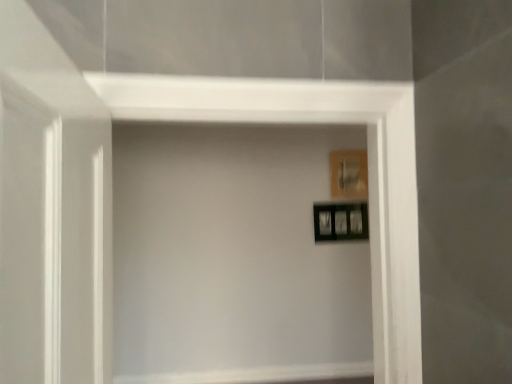
Question: Is transparent glass door at left to the left or to the right of black glossy picture frame at upper right, which appears as the 1th picture frame when ordered from the bottom, in the image?

Choices:
 (A) left
 (B) right

Answer: (A)

Question: Is point (51, 160) closer or farther from the camera than point (347, 218)?

Choices:
 (A) farther
 (B) closer

Answer: (B)

Question: Estimate the real-world distances between objects in this image. Which object is farther from the wooden picture frame at upper right, which is the 1th picture frame in top-to-bottom order?

Choices:
 (A) transparent glass door at left
 (B) black glossy picture frame at upper right, the 2th picture frame from the top

Answer: (A)

Question: Which object is positioned closest to the black glossy picture frame at upper right, the 2th picture frame from the top?

Choices:
 (A) wooden picture frame at upper right, which is the 1th picture frame in top-to-bottom order
 (B) transparent glass door at left

Answer: (A)